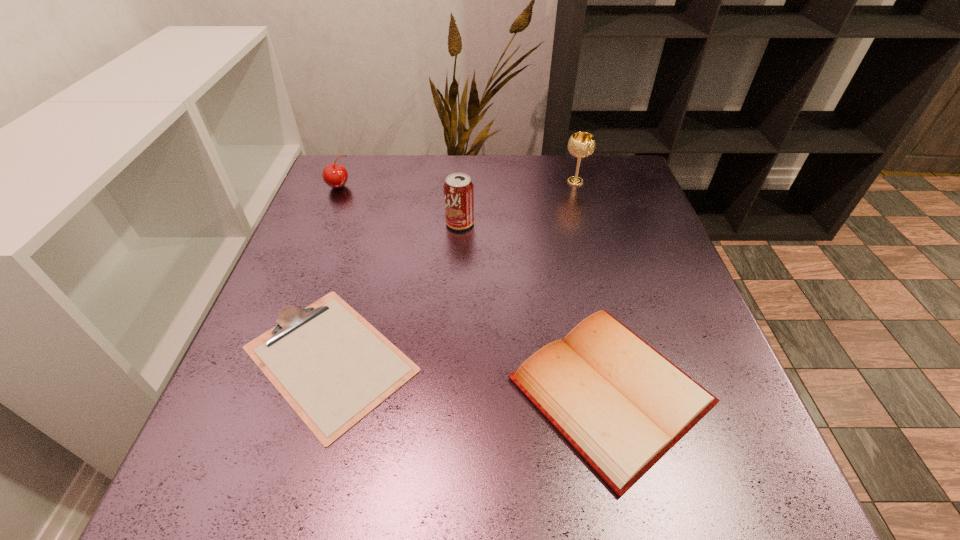
In order to click on chalice in this screenshot , I will do `click(581, 144)`.

Where is `the third object from right to left`? The image size is (960, 540). the third object from right to left is located at coordinates (458, 189).

Find the location of `the third nearest object`. the third nearest object is located at coordinates (458, 189).

The image size is (960, 540). Identify the location of cherry. (335, 175).

Locate an element on the screen. The height and width of the screenshot is (540, 960). Bible is located at coordinates (622, 405).

Locate an element on the screen. The height and width of the screenshot is (540, 960). the shortest object is located at coordinates (333, 367).

Locate an element on the screen. vacant region located 0.250m on the left of the chalice is located at coordinates (470, 181).

What are the coordinates of `vacant space located 0.230m on the right of the third object from left to right` in the screenshot? It's located at (568, 223).

I want to click on vacant space located 0.150m on the front of the third shortest object, so click(x=321, y=230).

Where is `vacant position located on the left of the fourth tallest object`? The width and height of the screenshot is (960, 540). vacant position located on the left of the fourth tallest object is located at coordinates (285, 390).